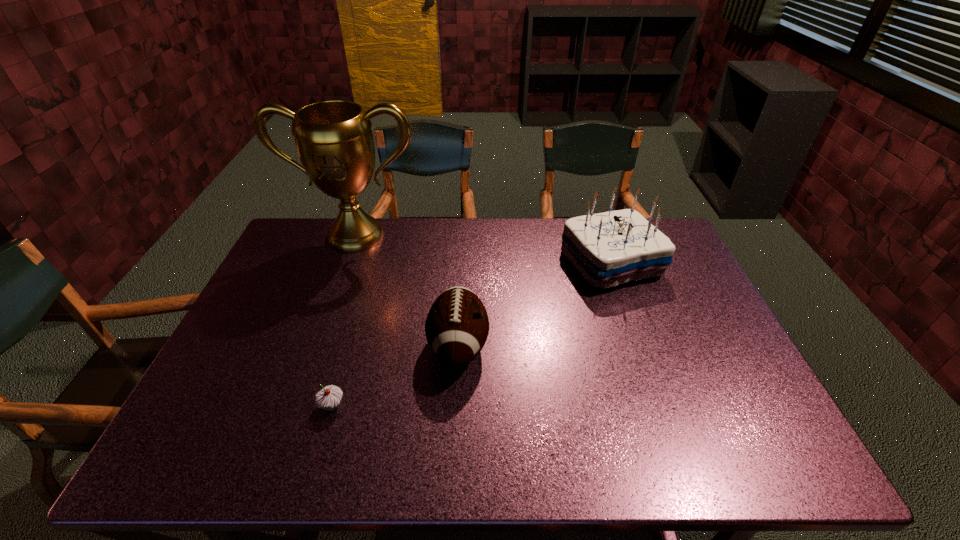
The image size is (960, 540). I want to click on trophy cup, so click(334, 140).

Find the location of a particular element. the rightmost object is located at coordinates pos(610,248).

You are a GUI agent. You are given a task and a screenshot of the screen. Output one action in this format:
    pyautogui.click(x=<x>, y=<y>)
    Task: Click on the birthday cake
    The image size is (960, 540).
    Given the screenshot: What is the action you would take?
    pyautogui.click(x=610, y=248)

Where is `football (American)`? football (American) is located at coordinates (457, 326).

Identify the location of the second object from right to left. (457, 326).

Where is `cupcake`? The image size is (960, 540). cupcake is located at coordinates (328, 398).

This screenshot has width=960, height=540. I want to click on the shortest object, so click(x=328, y=398).

The image size is (960, 540). I want to click on vacant space situated 0.270m on the surface of the trophy cup with symbols, so click(327, 314).

Identify the location of vacant area situated 0.140m on the front of the rightmost object. click(x=636, y=330).

Find the location of `vacant space located on the left of the football (American)`. vacant space located on the left of the football (American) is located at coordinates (296, 346).